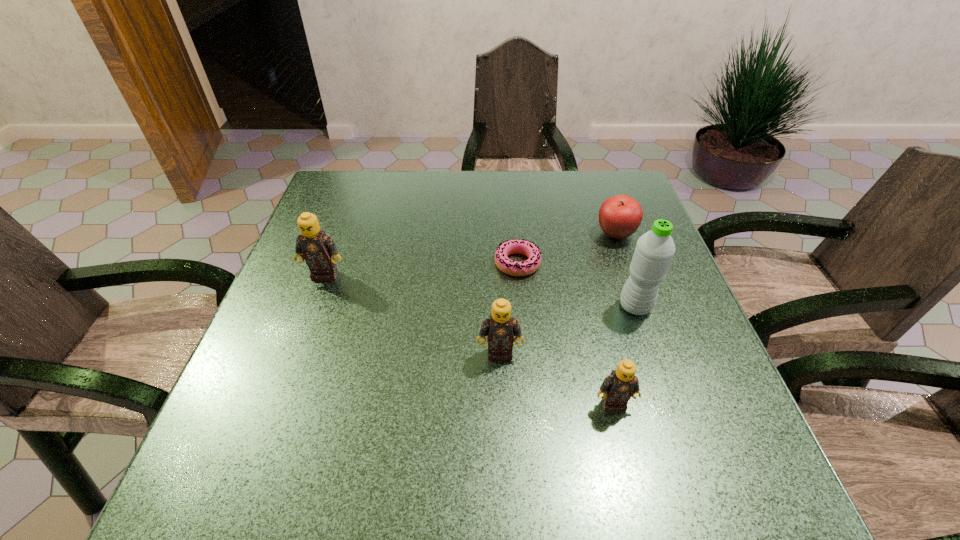
The height and width of the screenshot is (540, 960). I want to click on the leftmost Lego, so click(x=318, y=249).

Where is `the leftmost object`? Image resolution: width=960 pixels, height=540 pixels. the leftmost object is located at coordinates (318, 249).

You are a GUI agent. You are given a task and a screenshot of the screen. Output one action in this format:
    pyautogui.click(x=<x>, y=<y>)
    Task: Click on the second nearest object
    
    Given the screenshot: What is the action you would take?
    pyautogui.click(x=500, y=328)

You are a GUI agent. You are given a task and a screenshot of the screen. Output one action in this format:
    pyautogui.click(x=<x>, y=<y>)
    Task: Click on the second shortest Lego
    This screenshot has height=540, width=960.
    Given the screenshot: What is the action you would take?
    pyautogui.click(x=500, y=328)

Find the location of a particular element. This screenshot has height=540, width=960. the nearest Lego is located at coordinates (622, 384).

The height and width of the screenshot is (540, 960). What are the coordinates of `the shortest Lego` in the screenshot? It's located at (622, 384).

The height and width of the screenshot is (540, 960). What are the coordinates of `apple` in the screenshot? It's located at (620, 216).

The height and width of the screenshot is (540, 960). I want to click on the shortest object, so click(515, 246).

Where is `water bottle`? Image resolution: width=960 pixels, height=540 pixels. water bottle is located at coordinates (654, 251).

The width and height of the screenshot is (960, 540). I want to click on the tallest object, so pos(654,251).